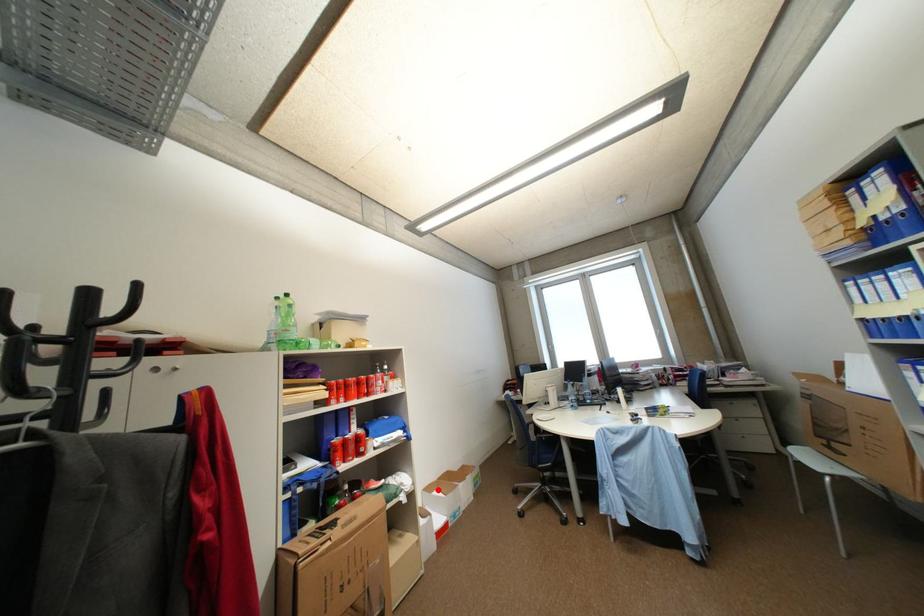
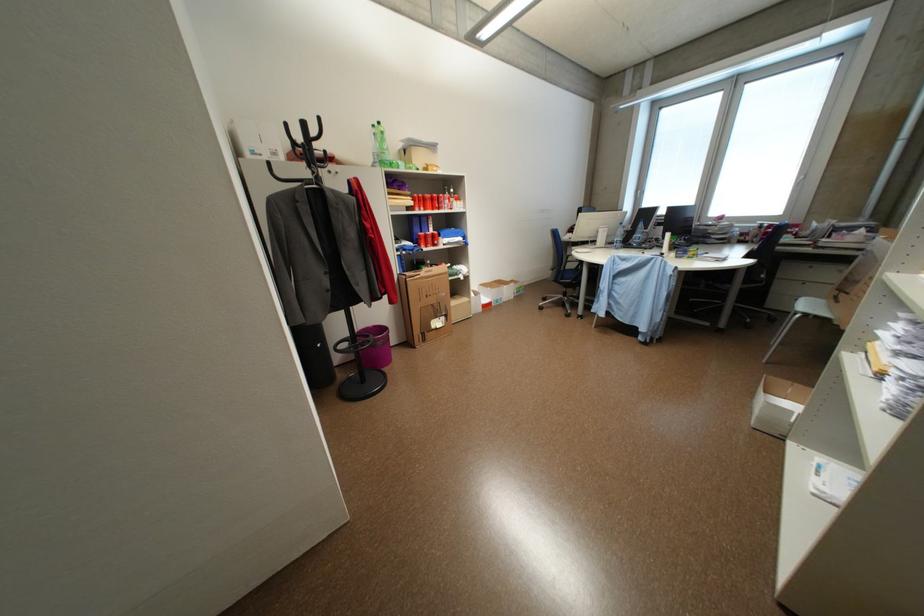
Question: I am providing you with two images of the same scene from different viewpoints. In image1, a red point is highlighted. Considering the same 3D point in image2, which of the following is correct?

Choices:
 (A) It is closer
 (B) It is farther

Answer: (A)